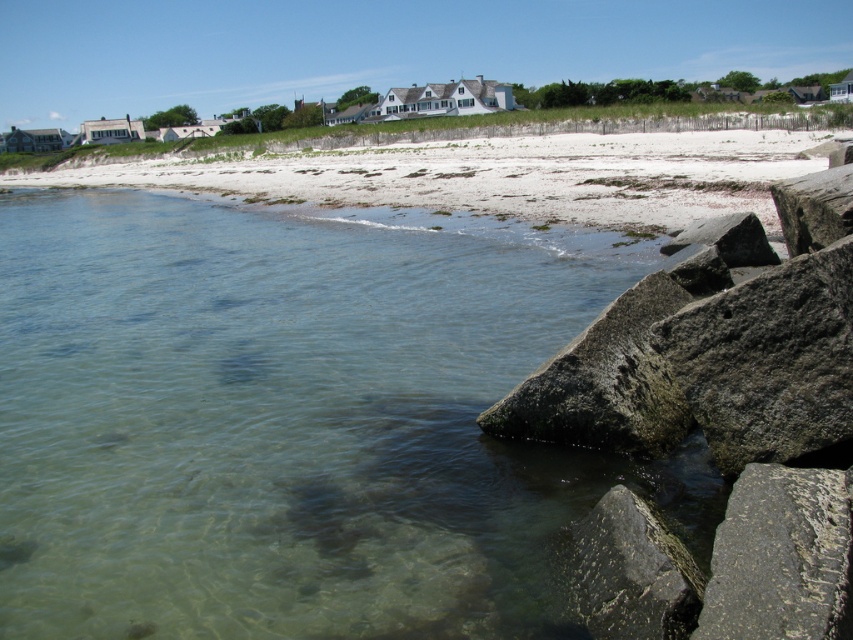
Question: Is gray rough rock at lower right wider than dark gray rough rock at lower right?

Choices:
 (A) yes
 (B) no

Answer: (A)

Question: Is gray rough rocks at lower right in front of gray rough rock at lower right?

Choices:
 (A) no
 (B) yes

Answer: (A)

Question: Which object is the farthest from the gray rough rocks at lower right?

Choices:
 (A) clear water at lower left
 (B) dark gray rough rock at lower right

Answer: (A)

Question: Which object is the farthest from the dark gray rough rock at lower right?

Choices:
 (A) smooth gray rock at lower right
 (B) clear water at lower left

Answer: (A)

Question: In this image, where is white sand beach at upper center located relative to dark gray rough rock at lower right?

Choices:
 (A) right
 (B) left

Answer: (B)

Question: Which point is farther from the camera taking this photo?

Choices:
 (A) (776, 588)
 (B) (631, 557)

Answer: (B)